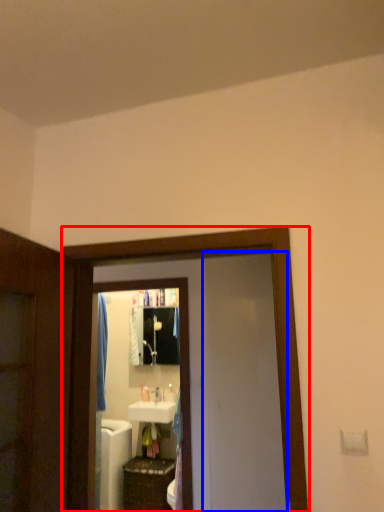
Question: Among these objects, which one is farthest to the camera, screen door (highlighted by a red box) or screen door (highlighted by a blue box)?

Choices:
 (A) screen door
 (B) screen door

Answer: (B)